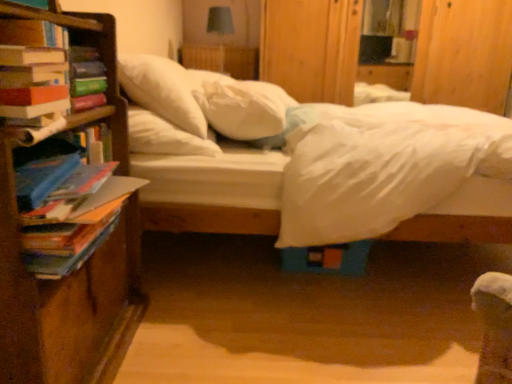
Question: Does white soft bed at center have a smaller size compared to multicolored paper book at left, the second book viewed from the top?

Choices:
 (A) yes
 (B) no

Answer: (B)

Question: Is white soft bed at center taller than multicolored paper book at left, placed as the first book when sorted from bottom to top?

Choices:
 (A) no
 (B) yes

Answer: (B)

Question: Are white soft bed at center and multicolored paper book at left, the second book viewed from the top, located far from each other?

Choices:
 (A) no
 (B) yes

Answer: (A)

Question: From the image's perspective, does white soft bed at center appear higher than multicolored paper book at left, placed as the first book when sorted from bottom to top?

Choices:
 (A) no
 (B) yes

Answer: (B)

Question: Considering the relative positions of white soft bed at center and multicolored paper book at left, the second book viewed from the top, in the image provided, is white soft bed at center to the left of multicolored paper book at left, the second book viewed from the top, from the viewer's perspective?

Choices:
 (A) no
 (B) yes

Answer: (A)

Question: Visually, is white soft bed at center positioned to the left or to the right of white soft pillow at center, the 2th pillow when ordered from right to left?

Choices:
 (A) left
 (B) right

Answer: (B)

Question: From a real-world perspective, is white soft bed at center positioned above or below white soft pillow at center, arranged as the 1th pillow when viewed from the left?

Choices:
 (A) below
 (B) above

Answer: (A)

Question: Looking at their shapes, would you say white soft bed at center is wider or thinner than white soft pillow at center, the 2th pillow when ordered from right to left?

Choices:
 (A) wide
 (B) thin

Answer: (A)

Question: From the image's perspective, is white soft bed at center positioned above or below white soft pillow at center, arranged as the 1th pillow when viewed from the left?

Choices:
 (A) below
 (B) above

Answer: (A)

Question: From a real-world perspective, is white soft pillow at center, the 2th pillow when ordered from right to left, positioned above or below blue fabric lampshade at upper center?

Choices:
 (A) below
 (B) above

Answer: (A)

Question: Is white soft pillow at center, arranged as the 1th pillow when viewed from the left, wider or thinner than blue fabric lampshade at upper center?

Choices:
 (A) wide
 (B) thin

Answer: (A)

Question: Does point (124, 74) appear closer or farther from the camera than point (227, 24)?

Choices:
 (A) closer
 (B) farther

Answer: (A)

Question: From the image's perspective, is white soft pillow at center, the 2th pillow when ordered from right to left, above or below blue fabric lampshade at upper center?

Choices:
 (A) below
 (B) above

Answer: (A)

Question: Is point (193, 102) closer or farther from the camera than point (96, 218)?

Choices:
 (A) farther
 (B) closer

Answer: (A)

Question: Based on their sizes in the image, would you say white soft pillow at center, arranged as the 1th pillow when viewed from the left, is bigger or smaller than multicolored paper book at left, placed as the first book when sorted from bottom to top?

Choices:
 (A) big
 (B) small

Answer: (A)